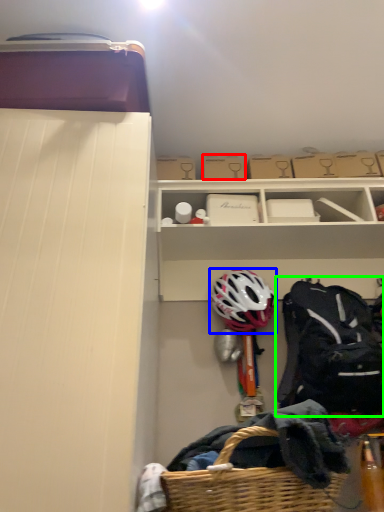
Question: Estimate the real-world distances between objects in this image. Which object is farther from storage box (highlighted by a red box), helmet (highlighted by a blue box) or backpack (highlighted by a green box)?

Choices:
 (A) helmet
 (B) backpack

Answer: (B)